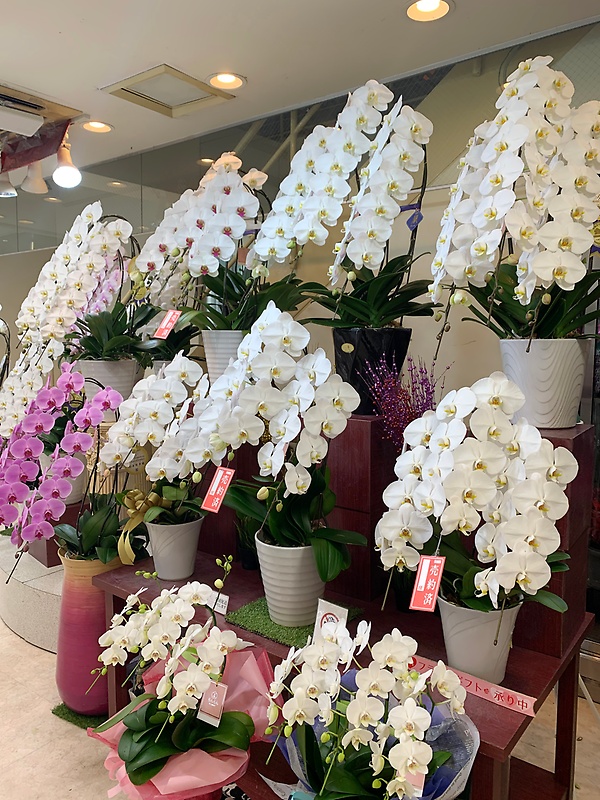
Locate an element on the screen. This screenshot has width=600, height=800. ceiling is located at coordinates (319, 45).